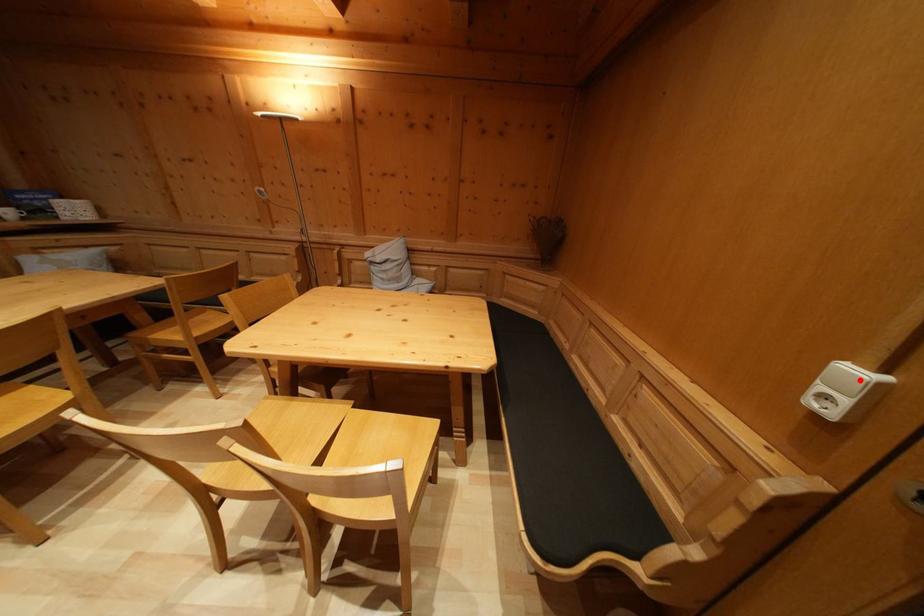
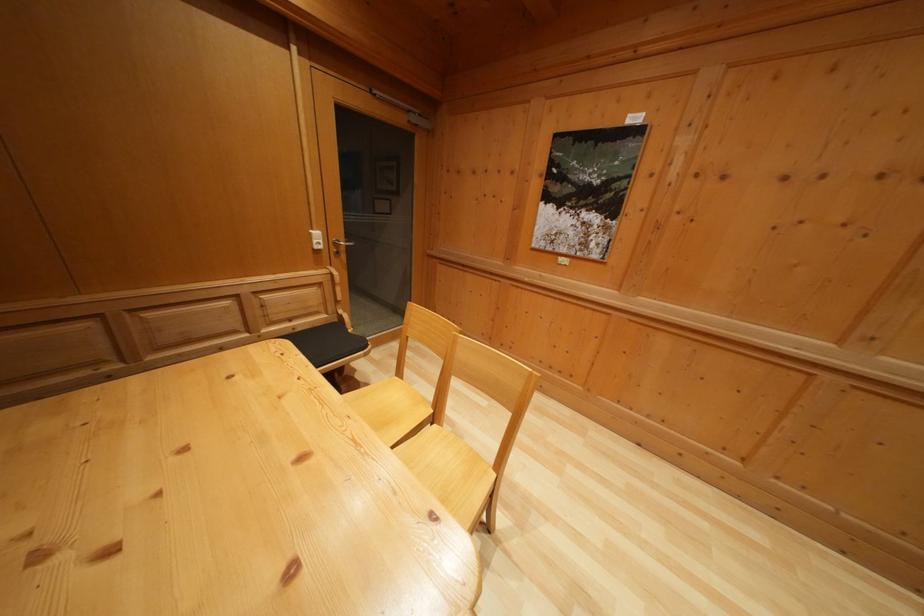
Question: I am providing you with two images of the same scene from different viewpoints. A red point is marked on the first image. Can you still see the location of the red point in image 2?

Choices:
 (A) Yes
 (B) No

Answer: (A)